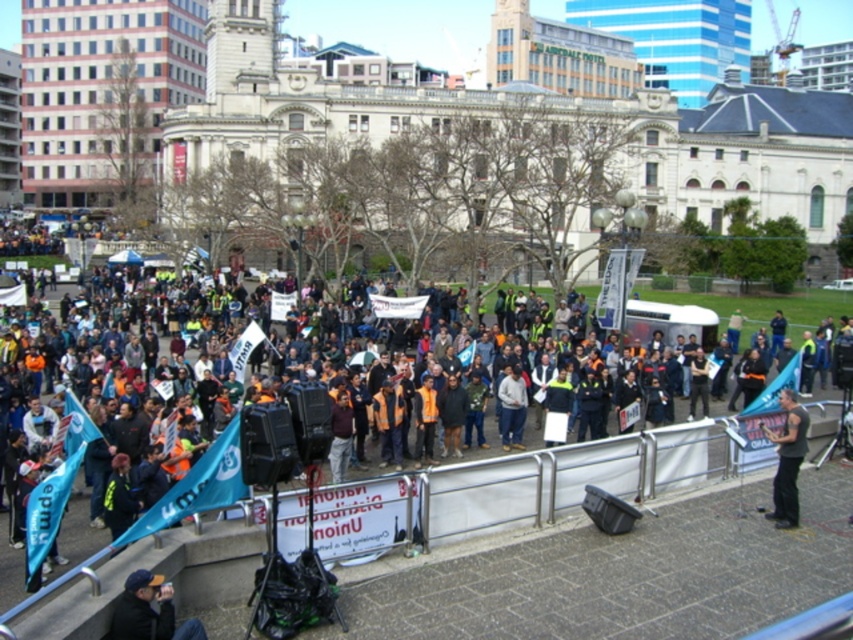
Question: Which object appears closest to the camera in this image?

Choices:
 (A) dark blue knit cap at lower left
 (B) black fabric shirt at lower right

Answer: (A)

Question: In this image, where is dark blue knit cap at lower left located relative to black fabric shirt at lower right?

Choices:
 (A) below
 (B) above

Answer: (A)

Question: Does dark blue knit cap at lower left have a greater width compared to black fabric shirt at lower right?

Choices:
 (A) no
 (B) yes

Answer: (A)

Question: Among these points, which one is nearest to the camera?

Choices:
 (A) (149, 589)
 (B) (779, 403)

Answer: (A)

Question: Can you confirm if dark blue knit cap at lower left is positioned to the left of black fabric shirt at lower right?

Choices:
 (A) no
 (B) yes

Answer: (B)